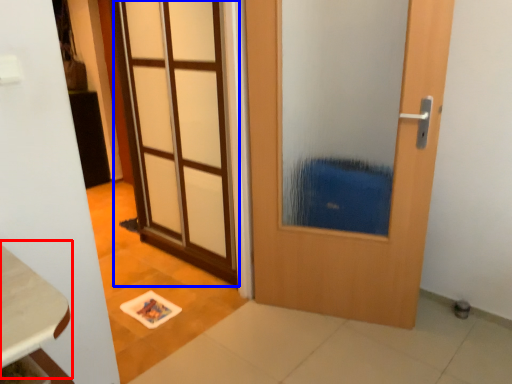
Question: Which object is further to the camera taking this photo, table (highlighted by a red box) or door (highlighted by a blue box)?

Choices:
 (A) table
 (B) door

Answer: (B)